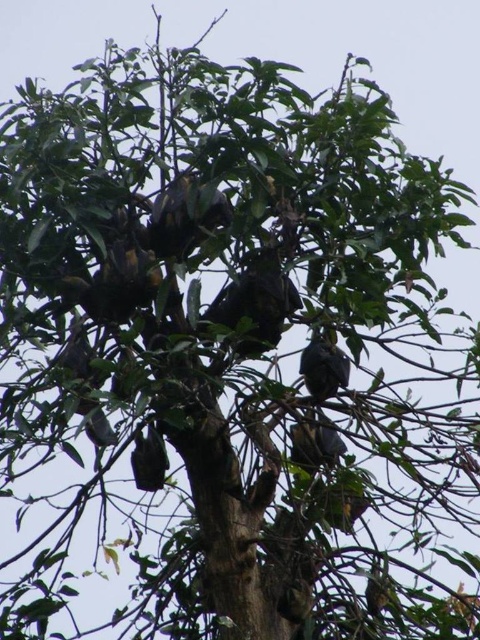
Question: Which point is closer to the camera taking this photo?

Choices:
 (A) (294, 456)
 (B) (313, 368)

Answer: (B)

Question: Can you confirm if dark brown fur bat at center is smaller than dark gray feathers at center?

Choices:
 (A) yes
 (B) no

Answer: (B)

Question: Which object is the closest to the dark gray fur bat at center?

Choices:
 (A) dark gray feathers at center
 (B) dark brown fur bat at center

Answer: (B)

Question: Does dark gray fur bat at center appear on the left side of dark gray feathers at center?

Choices:
 (A) yes
 (B) no

Answer: (B)

Question: Is dark brown fur bat at center wider than dark gray feathers at center?

Choices:
 (A) yes
 (B) no

Answer: (A)

Question: Among these points, which one is nearest to the camera?

Choices:
 (A) (284, 308)
 (B) (305, 445)

Answer: (A)